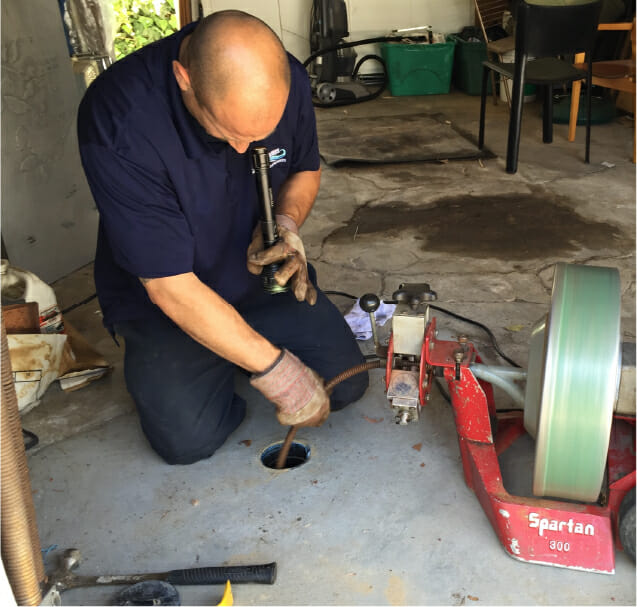
Locate an element on the screen. This screenshot has width=637, height=607. chair legs is located at coordinates (547, 121), (588, 135), (513, 136), (482, 113).